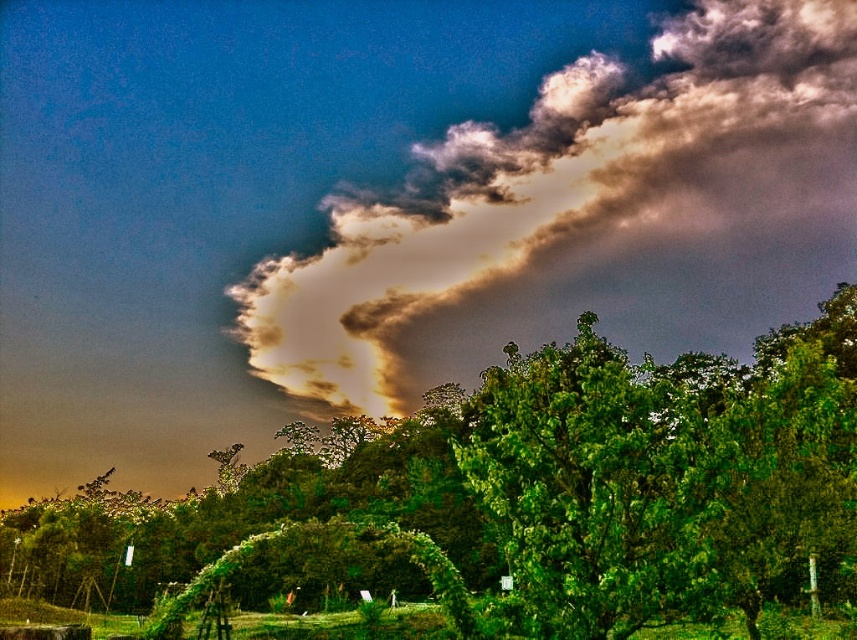
Who is higher up, green leafy tree at center or cloudy textured sky at upper center?

cloudy textured sky at upper center is above.

Who is lower down, green leafy tree at center or cloudy textured sky at upper center?

green leafy tree at center

At what (x,y) coordinates should I click in order to perform the action: click on green leafy tree at center. Please return your answer as a coordinate pair (x, y). Image resolution: width=857 pixels, height=640 pixels. Looking at the image, I should click on (506, 504).